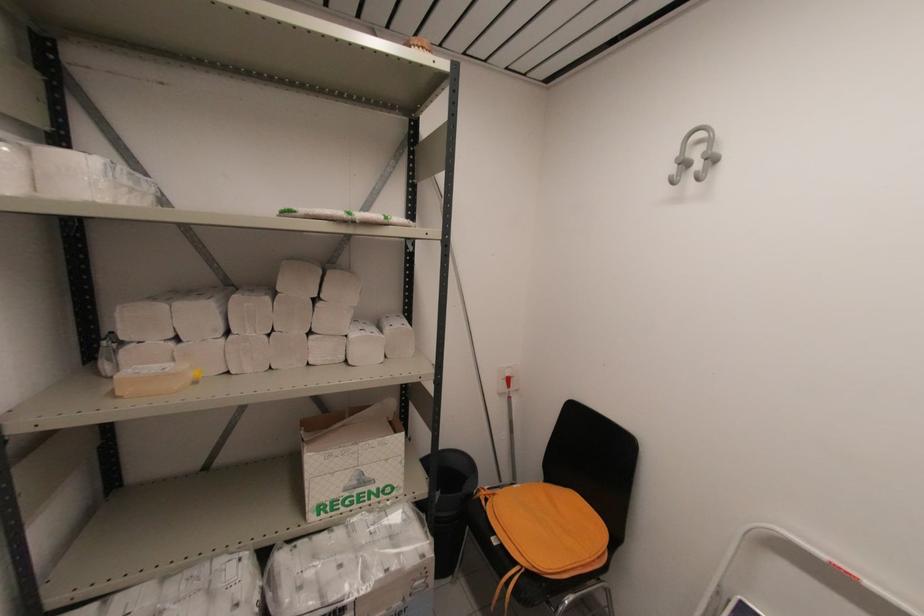
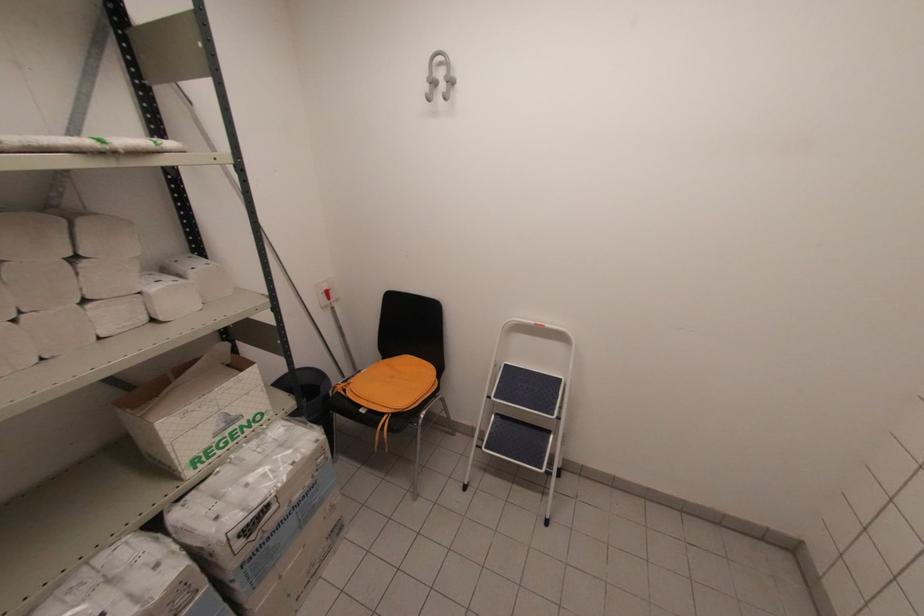
Locate, in the second image, the point that corresponds to point (356, 483) in the first image.

(224, 426)